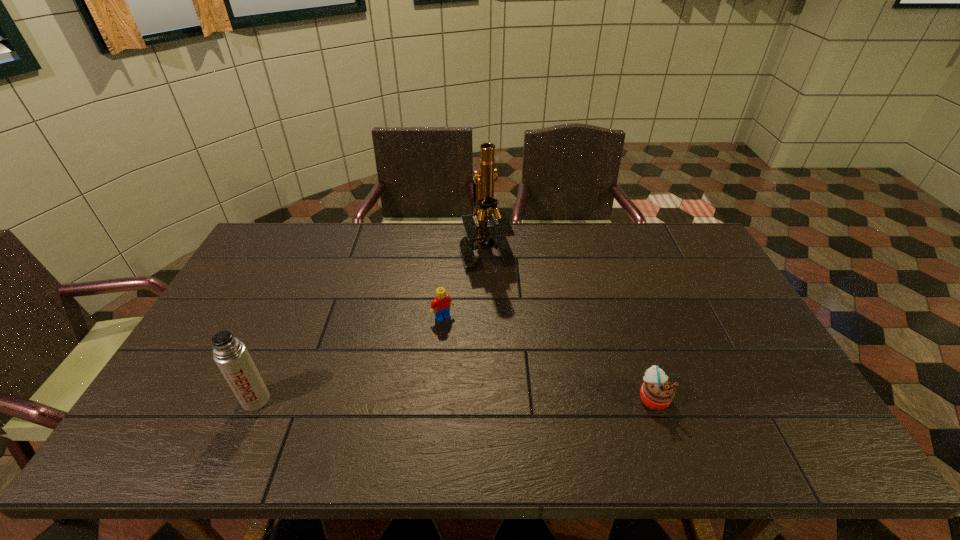
Find the location of `blank space located on the face of the third object from right to left`. blank space located on the face of the third object from right to left is located at coordinates (466, 348).

Locate an element on the screen. blank space located on the face of the third object from right to left is located at coordinates (466, 348).

What are the coordinates of `free space located at the eyepiece of the farthest object` in the screenshot? It's located at (453, 359).

At what (x,y) coordinates should I click in order to perform the action: click on vacant region located 0.360m at the eyepiece of the farthest object. Please return your answer as a coordinate pair (x, y). The image size is (960, 540). Looking at the image, I should click on (454, 356).

Find the location of a particular element. The height and width of the screenshot is (540, 960). vacant space located at the eyepiece of the farthest object is located at coordinates (478, 282).

The width and height of the screenshot is (960, 540). Identify the location of object located in the far edge section of the desktop. (478, 234).

The image size is (960, 540). Find the location of `thermos bottle present at the near edge`. thermos bottle present at the near edge is located at coordinates (230, 354).

This screenshot has height=540, width=960. Identify the location of muffin that is at the near edge. (657, 393).

The width and height of the screenshot is (960, 540). What are the coordinates of `free region at the far edge of the desktop` in the screenshot? It's located at (330, 256).

You are a GUI agent. You are given a task and a screenshot of the screen. Output one action in this format:
    pyautogui.click(x=<x>, y=<y>)
    Task: Click on the vacant area at the near edge
    The width and height of the screenshot is (960, 540).
    Given the screenshot: What is the action you would take?
    pyautogui.click(x=408, y=397)